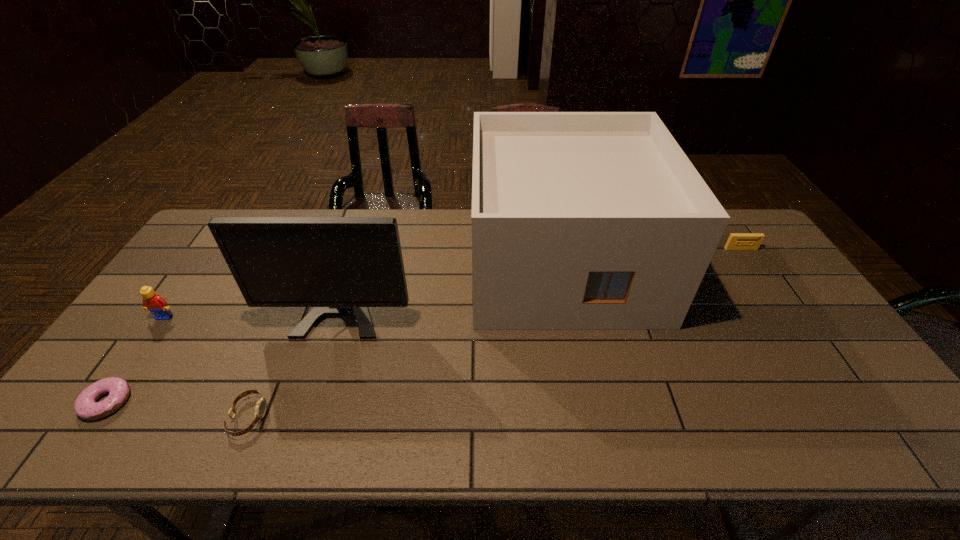
The image size is (960, 540). Identify the location of object that is at the right edge. (737, 241).

The height and width of the screenshot is (540, 960). I want to click on object that is at the near left corner, so click(x=86, y=406).

Locate an element on the screen. The image size is (960, 540). object that is at the far right corner is located at coordinates (737, 241).

Identify the location of free space at the far edge of the desktop. (372, 214).

Identify the location of vacant region at the near edge of the desktop. (228, 422).

The image size is (960, 540). Find the location of `vacant space at the right edge`. vacant space at the right edge is located at coordinates pyautogui.click(x=756, y=267).

This screenshot has height=540, width=960. In the image, there is a desktop. In order to click on free space at the far left corner in this screenshot , I will do `click(252, 209)`.

In the image, there is a desktop. At what (x,y) coordinates should I click in order to perform the action: click on vacant area at the far right corner. Please return your answer as a coordinate pair (x, y). This screenshot has height=540, width=960. Looking at the image, I should click on (749, 224).

Find the location of a particular element. free point between the computer monitor and the shortest object is located at coordinates pyautogui.click(x=229, y=339).

Locate an element on the screen. The width and height of the screenshot is (960, 540). free space between the videotape and the Lego is located at coordinates (453, 283).